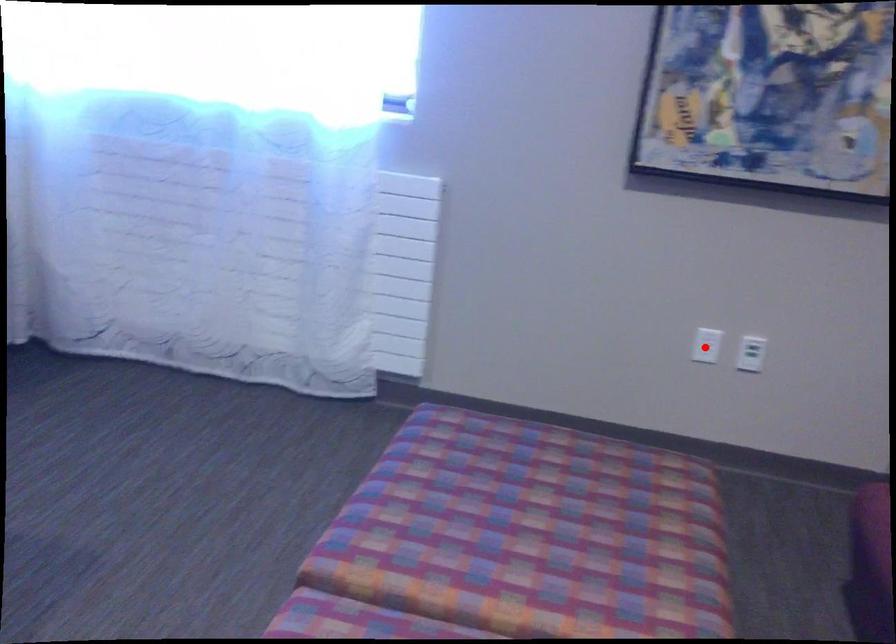
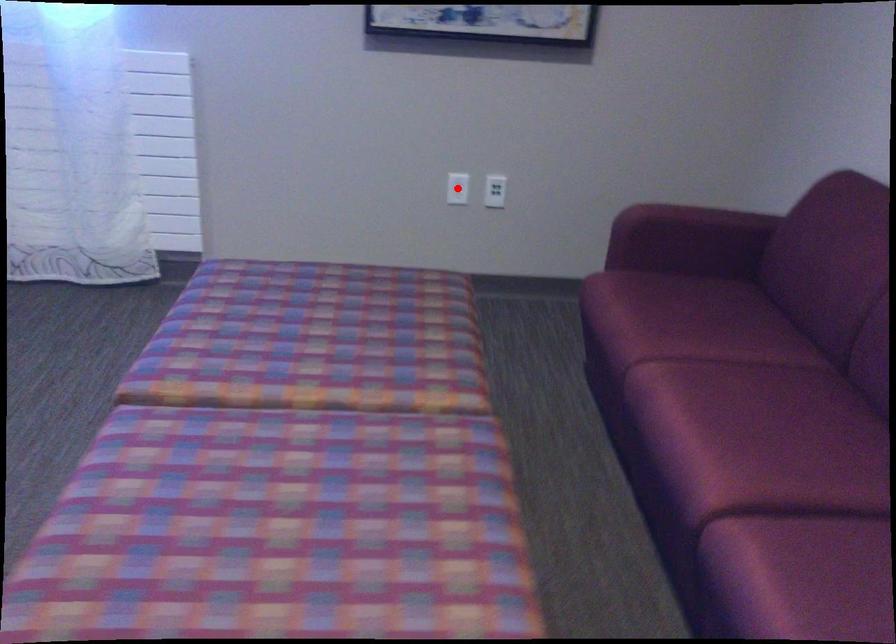
I am providing you with two images of the same scene from different viewpoints. A red point is marked on the first image and another point is marked on the second image. Is the red point in image1 aligned with the point shown in image2?

Yes